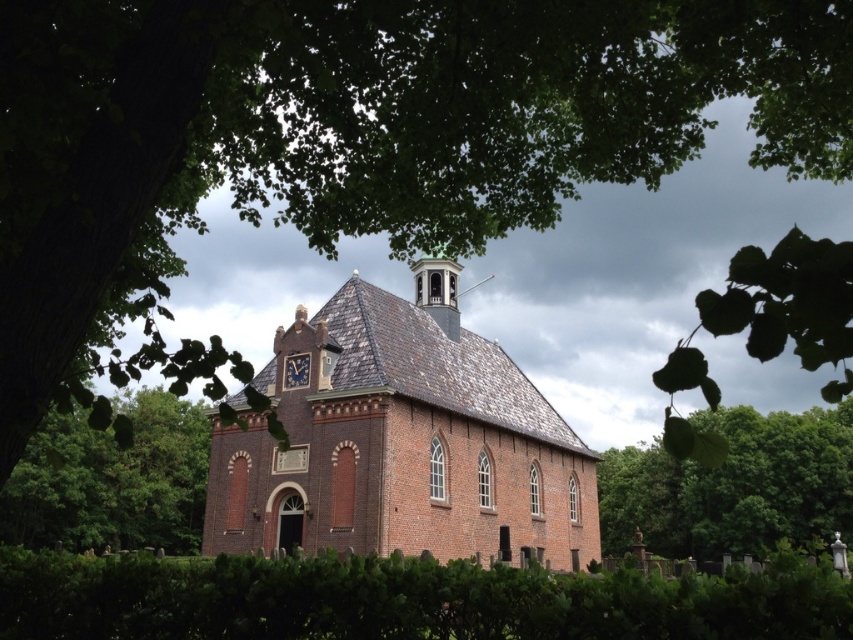
Question: Considering the relative positions of brown brick church at center and green leafy tree at right in the image provided, where is brown brick church at center located with respect to green leafy tree at right?

Choices:
 (A) right
 (B) left

Answer: (B)

Question: Does brown brick church at center have a larger size compared to green leafy hedge at lower center?

Choices:
 (A) yes
 (B) no

Answer: (A)

Question: Which object appears farthest from the camera in this image?

Choices:
 (A) green leafy tree at right
 (B) green leafy hedge at lower center
 (C) green leafy tree at lower left
 (D) brown brick church at center

Answer: (A)

Question: Is brown brick church at center behind green leafy tree at lower left?

Choices:
 (A) yes
 (B) no

Answer: (A)

Question: Which point is closer to the camera taking this photo?

Choices:
 (A) (628, 499)
 (B) (283, 369)
 (C) (151, 426)

Answer: (B)

Question: Which point appears closest to the camera in this image?

Choices:
 (A) tap(146, 600)
 (B) tap(293, 378)
 (C) tap(364, 454)

Answer: (A)